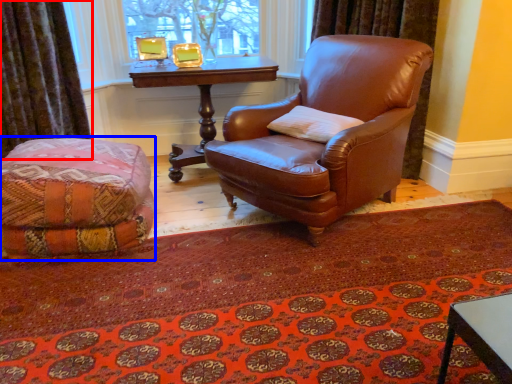
Question: Which point is closer to the camera, curtain (highlighted by a red box) or couch (highlighted by a blue box)?

Choices:
 (A) curtain
 (B) couch

Answer: (B)